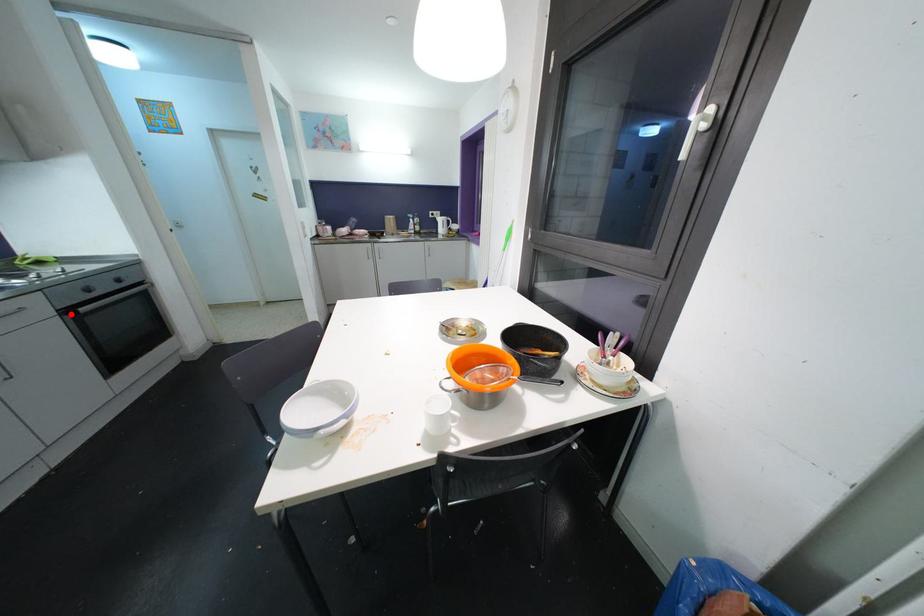
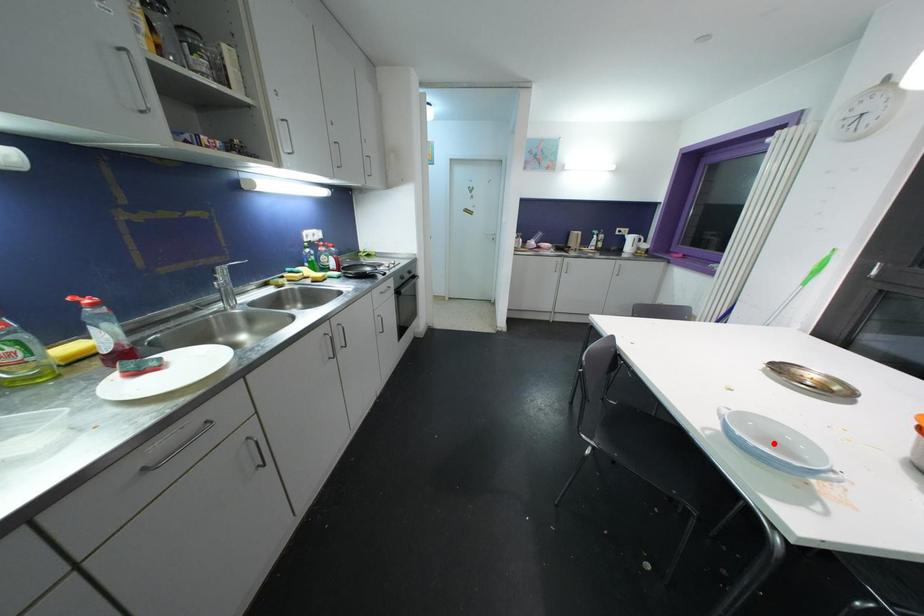
I am providing you with two images of the same scene from different viewpoints. A red point is marked on the first image and another point is marked on the second image. Is the marked point in image1 the same physical position as the marked point in image2?

No